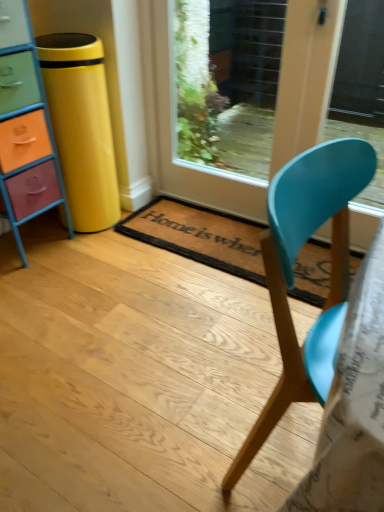
Locate an element on the screen. This screenshot has width=384, height=512. free spot in front of wooden glass door at center is located at coordinates (185, 321).